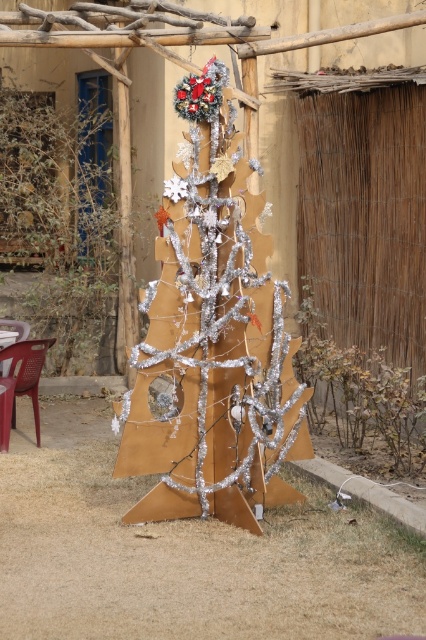
Between silver metallic christmas tree at center and shiny silver tree at center, which one is positioned higher?

shiny silver tree at center is above.

What do you see at coordinates (213, 337) in the screenshot?
I see `silver metallic christmas tree at center` at bounding box center [213, 337].

Measure the distance between point (173, 288) and camera.

19.89 feet

Where is `silver metallic christmas tree at center`? silver metallic christmas tree at center is located at coordinates (213, 337).

Image resolution: width=426 pixels, height=640 pixels. Describe the element at coordinates (213, 337) in the screenshot. I see `silver metallic christmas tree at center` at that location.

Who is more forward, (146, 285) or (114, 16)?

Point (114, 16) is in front.

Is point (256, 467) more distant than point (259, 54)?

No, it is in front of (259, 54).

Find the location of a particular element. silver metallic christmas tree at center is located at coordinates (213, 337).

Is shiny silver tree at center in front of silver metallic tree at center?

No, it is behind silver metallic tree at center.

Does shiny silver tree at center appear under silver metallic tree at center?

Yes.

Identify the location of shiny silver tree at center. The image size is (426, 640). (63, 216).